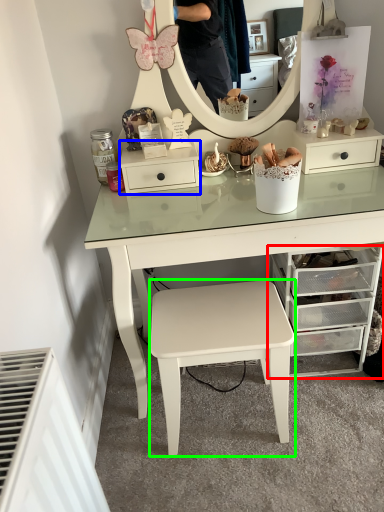
Question: Which object is positioned farthest from chest of drawers (highlighted by a red box)? Select from nightstand (highlighted by a blue box) and stool (highlighted by a green box).

Choices:
 (A) nightstand
 (B) stool

Answer: (A)